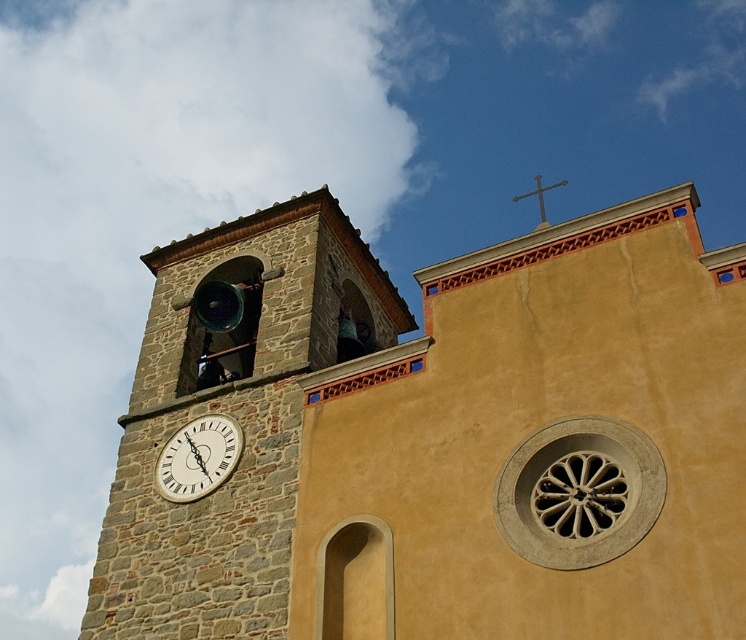
Question: Which object appears closest to the camera in this image?

Choices:
 (A) metallic cross at upper center
 (B) whitematerial/textureclock at center-left

Answer: (B)

Question: Which of these objects is positioned closest to the whitematerial/textureclock at center-left?

Choices:
 (A) stone clock tower at upper left
 (B) metallic cross at upper center

Answer: (A)

Question: Can you confirm if stone clock tower at upper left is bigger than whitematerial/textureclock at center-left?

Choices:
 (A) no
 (B) yes

Answer: (B)

Question: Which object is closer to the camera taking this photo?

Choices:
 (A) whitematerial/textureclock at center-left
 (B) stone clock tower at upper left

Answer: (B)

Question: Can you confirm if stone clock tower at upper left is positioned to the left of whitematerial/textureclock at center-left?

Choices:
 (A) no
 (B) yes

Answer: (A)

Question: From the image, what is the correct spatial relationship of stone clock tower at upper left in relation to whitematerial/textureclock at center-left?

Choices:
 (A) right
 (B) left

Answer: (A)